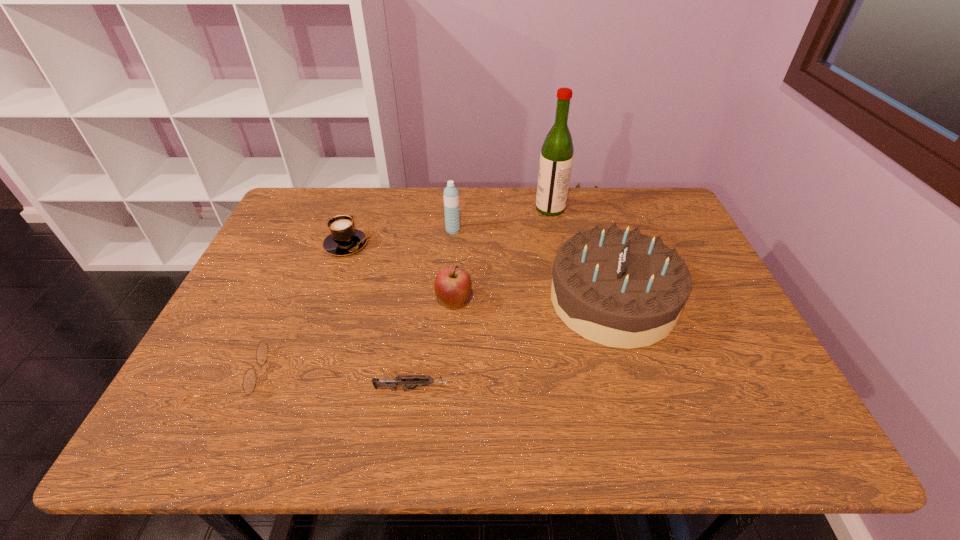
At what (x,y) coordinates should I click in order to perform the action: click on liquor that is at the far edge. Please return your answer as a coordinate pair (x, y). This screenshot has height=540, width=960. Looking at the image, I should click on (556, 158).

Locate an element on the screen. The width and height of the screenshot is (960, 540). water bottle that is at the far edge is located at coordinates (451, 194).

The height and width of the screenshot is (540, 960). In order to click on object that is positioned at the left edge in this screenshot , I will do `click(249, 381)`.

What are the coordinates of `object present at the right edge` in the screenshot? It's located at (618, 288).

I want to click on vacant space at the far edge of the desktop, so click(352, 197).

What are the coordinates of `free space at the near edge` in the screenshot? It's located at (385, 408).

Identify the location of vacant area at the left edge. Image resolution: width=960 pixels, height=540 pixels. (205, 359).

Identify the location of vacant region at the right edge of the desktop. The height and width of the screenshot is (540, 960). (708, 393).

This screenshot has height=540, width=960. In the image, there is a desktop. Find the location of `vacant region at the far left corner`. vacant region at the far left corner is located at coordinates [x=292, y=218].

Identify the location of free space at the near left corner of the desktop. The height and width of the screenshot is (540, 960). (179, 421).